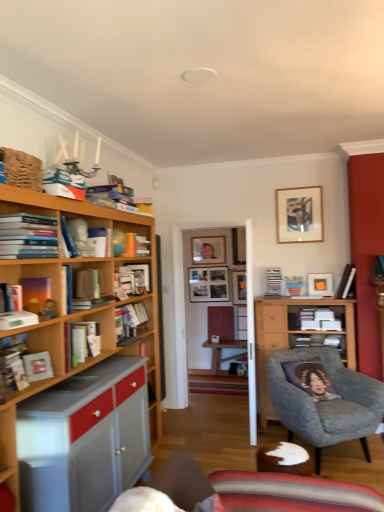
Question: From a real-world perspective, is matte purple book at left, which ranks as the fifth book in front-to-back order, located beneath hardcover book at left, which is the sixth book from left to right?

Choices:
 (A) no
 (B) yes

Answer: (A)

Question: Does matte purple book at left, which is the 4th book in left-to-right order, contain hardcover book at left, which ranks as the seventh book in front-to-back order?

Choices:
 (A) yes
 (B) no

Answer: (B)

Question: Can you confirm if matte purple book at left, which ranks as the fifth book in front-to-back order, is bigger than hardcover book at left, which is counted as the sixth book, starting from the back?

Choices:
 (A) yes
 (B) no

Answer: (B)

Question: Is matte purple book at left, which ranks as the fifth book in front-to-back order, looking in the opposite direction of hardcover book at left, the seventh book positioned from the right?

Choices:
 (A) no
 (B) yes

Answer: (A)

Question: Considering the relative sizes of matte purple book at left, which is the 4th book in left-to-right order, and hardcover book at left, which is counted as the sixth book, starting from the back, in the image provided, is matte purple book at left, which is the 4th book in left-to-right order, taller than hardcover book at left, which is counted as the sixth book, starting from the back,?

Choices:
 (A) no
 (B) yes

Answer: (B)

Question: From the image's perspective, does matte purple book at left, which is the 4th book in left-to-right order, appear higher than hardcover book at left, which is the sixth book from left to right?

Choices:
 (A) yes
 (B) no

Answer: (A)

Question: Does matte black picture frame at upper center, arranged as the first picture frame when viewed from the back, have a greater width compared to black matte picture frame at center, placed as the third picture frame when sorted from front to back?

Choices:
 (A) no
 (B) yes

Answer: (B)

Question: Is matte black picture frame at upper center, arranged as the first picture frame when viewed from the back, thinner than black matte picture frame at center, the second picture frame viewed from the back?

Choices:
 (A) no
 (B) yes

Answer: (A)

Question: Is matte black picture frame at upper center, positioned as the fourth picture frame in front-to-back order, positioned with its back to black matte picture frame at center, placed as the third picture frame when sorted from front to back?

Choices:
 (A) yes
 (B) no

Answer: (B)

Question: Is matte black picture frame at upper center, positioned as the fourth picture frame in front-to-back order, facing towards black matte picture frame at center, the second picture frame viewed from the back?

Choices:
 (A) no
 (B) yes

Answer: (A)

Question: Is matte black picture frame at upper center, positioned as the fourth picture frame in front-to-back order, outside of black matte picture frame at center, placed as the third picture frame when sorted from front to back?

Choices:
 (A) yes
 (B) no

Answer: (A)

Question: Is matte black picture frame at upper center, positioned as the fourth picture frame in front-to-back order, closer to the viewer compared to black matte picture frame at center, the second picture frame viewed from the back?

Choices:
 (A) yes
 (B) no

Answer: (B)

Question: Can we say hardcover book at left, which is the 2th book from front to back, lies outside hardcover book at upper right, marked as the 1th book in a right-to-left arrangement?

Choices:
 (A) yes
 (B) no

Answer: (A)